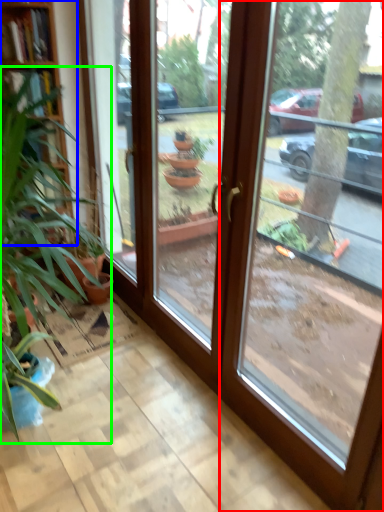
Question: Which object is the farthest from window (highlighted by a red box)? Choose among these: bookshelf (highlighted by a blue box) or houseplant (highlighted by a green box).

Choices:
 (A) bookshelf
 (B) houseplant

Answer: (A)